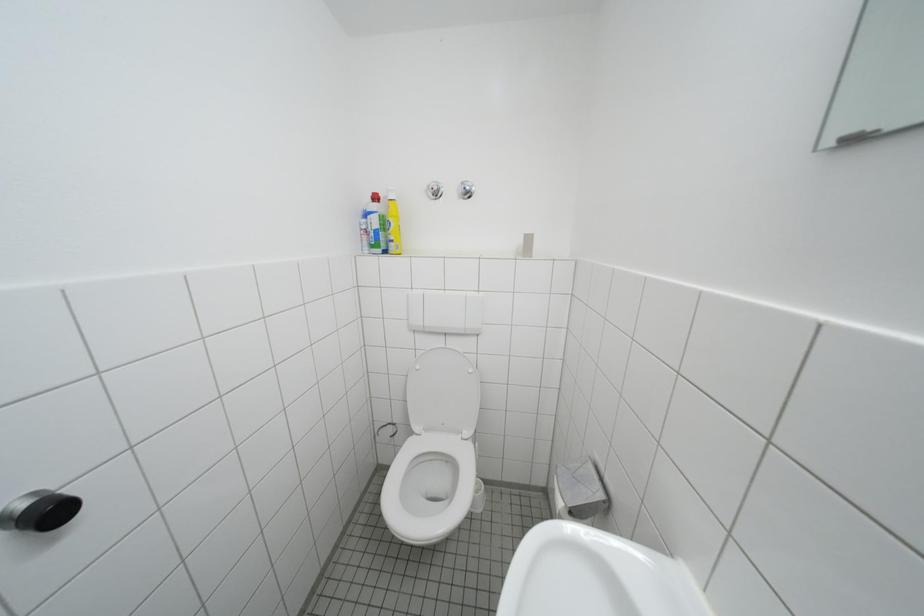
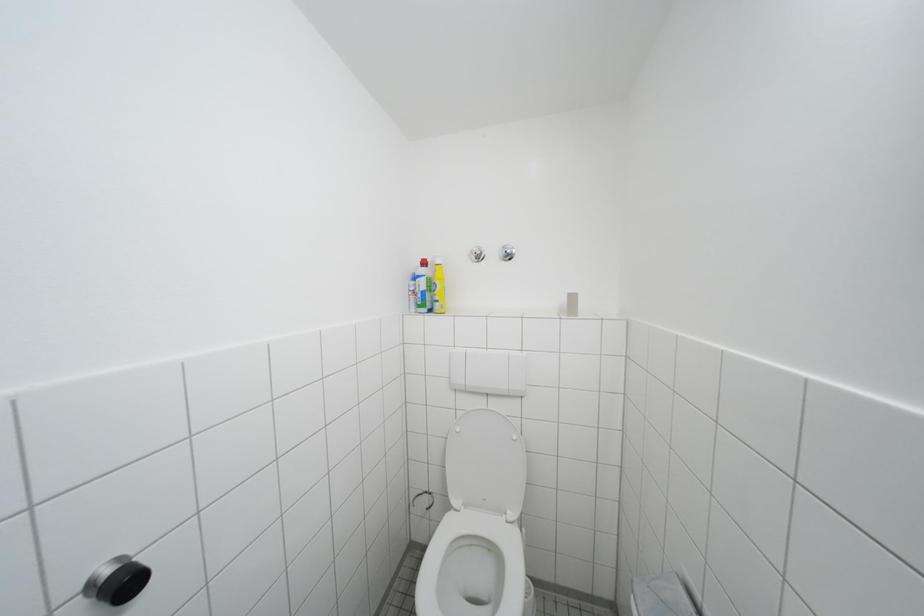
Question: The images are taken continuously from a first-person perspective. In which direction is your viewpoint rotating?

Choices:
 (A) Left
 (B) Right
 (C) Up
 (D) Down

Answer: (C)